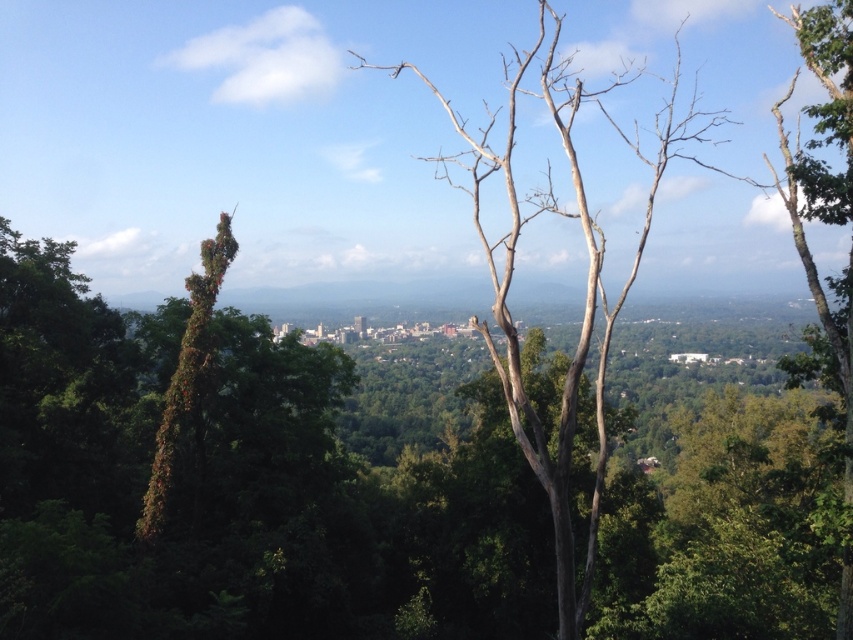
You are a park ranger planning to place a bench between the green leafy tree at center and the bare wood tree at center. The bench requires 5 meters of space to be placed comfortably. Can you fit the bench between them?

The green leafy tree at center and bare wood tree at center are 47.76 meters apart. Since the bench requires 5 meters of space, there is sufficient distance to place the bench comfortably between them.

You are standing at the vantage point looking at the scene. There are two points marked in the image. Which point, point [218,436] or point [662,140], is closer to you?

Point [218,436] is closer to the viewer than point [662,140].

You are an environmental scientist analyzing the health of the forest. You observe the green leafy tree at center and the bare wood tree at center. Which tree would you prioritize for further investigation regarding potential health issues?

The bare wood tree at center would be prioritized for investigation since it lacks leaves, indicating possible health issues, while the green leafy tree at center is thinner but appears healthy with foliage.